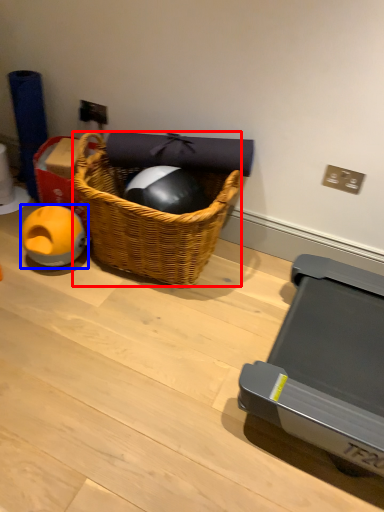
Question: Among these objects, which one is farthest to the camera, picnic basket (highlighted by a red box) or toy (highlighted by a blue box)?

Choices:
 (A) picnic basket
 (B) toy

Answer: (B)